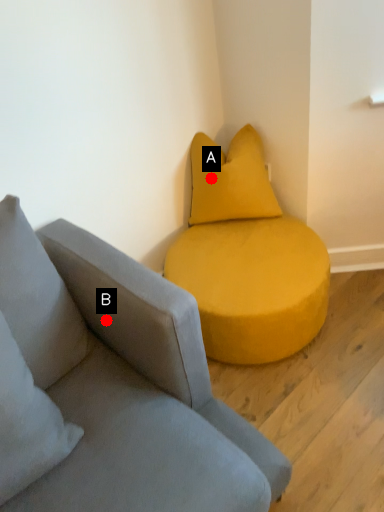
Question: Two points are circled on the image, labeled by A and B beside each circle. Among these points, which one is farthest from the camera?

Choices:
 (A) A is further
 (B) B is further

Answer: (A)